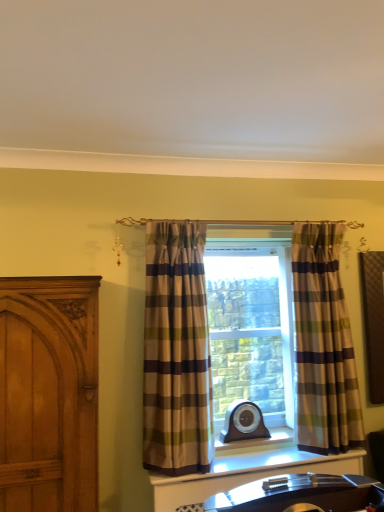
Question: Relative to wooden carved door at left, is plaid fabric curtain at center, the second curtain from the right, in front or behind?

Choices:
 (A) front
 (B) behind

Answer: (B)

Question: Choose the correct answer: Is plaid fabric curtain at center, the second curtain from the right, inside wooden carved door at left or outside it?

Choices:
 (A) outside
 (B) inside

Answer: (A)

Question: Which object is the closest to the wooden carved door at left?

Choices:
 (A) plaid fabric curtain at center, placed as the 2th curtain when sorted from left to right
 (B) plaid fabric curtain at center, the second curtain from the right

Answer: (B)

Question: Based on their relative distances, which object is farther from the wooden carved door at left?

Choices:
 (A) plaid fabric curtain at center, the first curtain positioned from the left
 (B) plaid fabric curtain at center, which ranks as the first curtain in right-to-left order

Answer: (B)